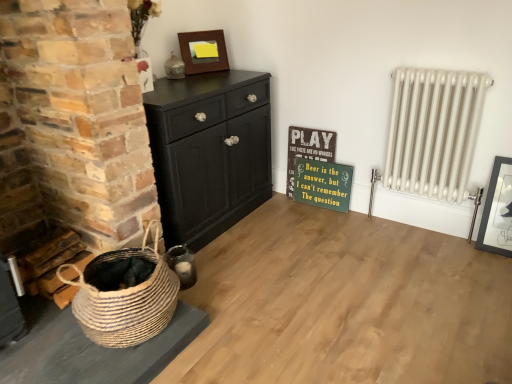
The height and width of the screenshot is (384, 512). I want to click on vacant space that is to the left of natural woven basket at lower left, so click(x=39, y=336).